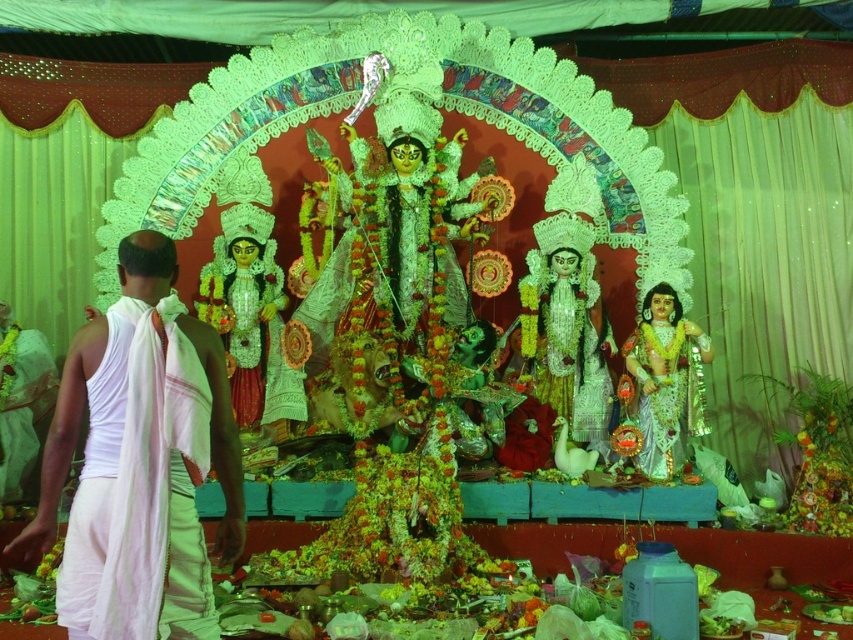
Question: Can you confirm if white clothed person at left is positioned to the right of shiny silver statue at center?

Choices:
 (A) no
 (B) yes

Answer: (A)

Question: Which object is closer to the camera taking this photo?

Choices:
 (A) shiny silver statue at center
 (B) white clothed person at left

Answer: (B)

Question: Which point is closer to the camera?

Choices:
 (A) (693, 403)
 (B) (178, 326)

Answer: (B)

Question: Can you confirm if white clothed person at left is bigger than shiny silver statue at center?

Choices:
 (A) yes
 (B) no

Answer: (A)

Question: Is white clothed person at left to the right of shiny silver statue at center from the viewer's perspective?

Choices:
 (A) no
 (B) yes

Answer: (A)